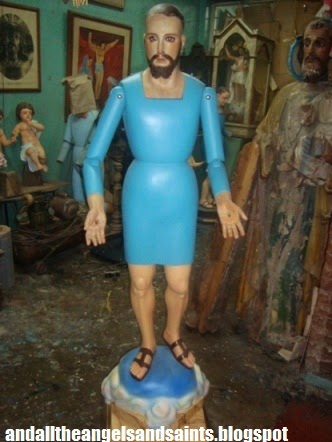
Locate an element on the screen. Image resolution: width=332 pixels, height=442 pixels. empty space on floor is located at coordinates (58, 322).